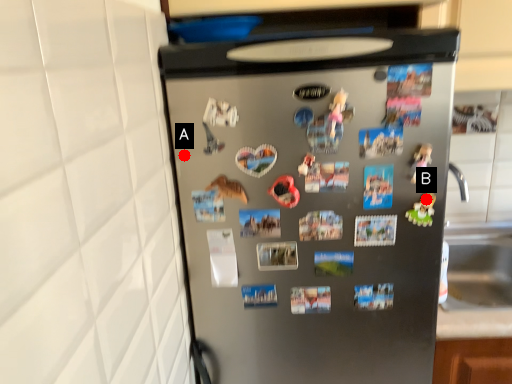
Question: Two points are circled on the image, labeled by A and B beside each circle. Which point is farther to the camera?

Choices:
 (A) A is further
 (B) B is further

Answer: (A)